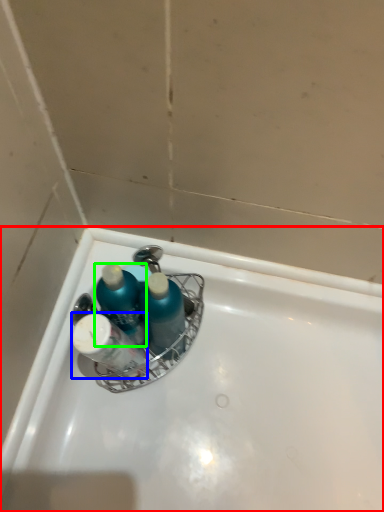
Question: Based on their relative distances, which object is nearer to bathtub (highlighted by a red box)? Choose from toiletry (highlighted by a blue box) and mouthwash (highlighted by a green box).

Choices:
 (A) toiletry
 (B) mouthwash

Answer: (A)